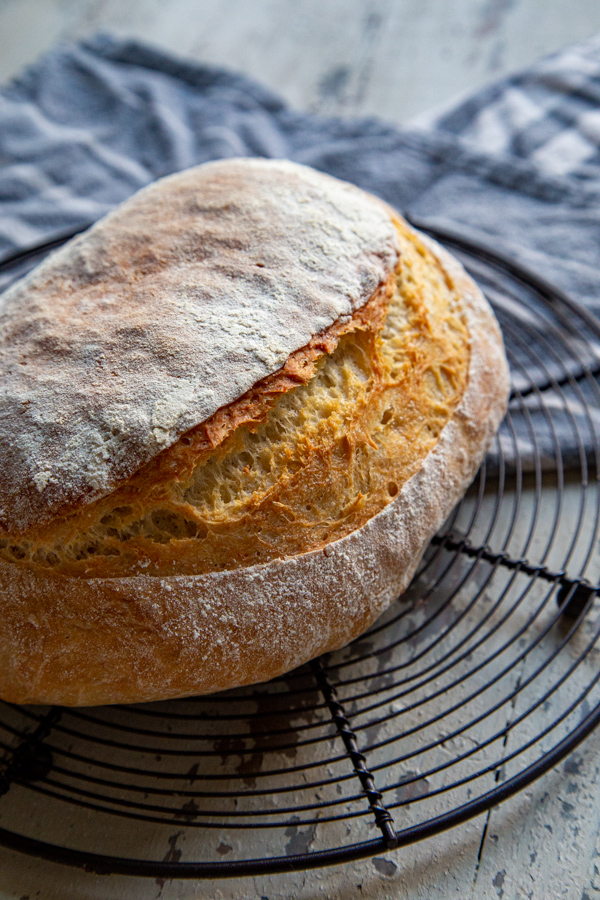
Locate an element on the screen. The image size is (600, 900). rack is located at coordinates (388, 663).